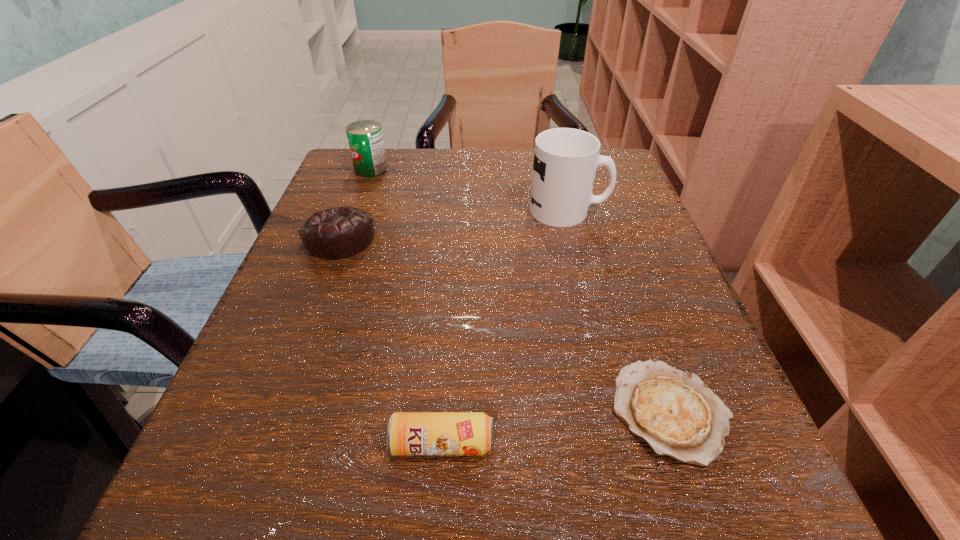
The width and height of the screenshot is (960, 540). I want to click on the tallest object, so click(565, 159).

Find the location of a particular element. The image size is (960, 540). the fourth shortest object is located at coordinates (365, 137).

The width and height of the screenshot is (960, 540). I want to click on the farthest object, so click(365, 137).

Find the location of a particular element. the third shortest object is located at coordinates (342, 232).

This screenshot has height=540, width=960. I want to click on the fourth tallest object, so coord(408,433).

Locate an element on the screen. The image size is (960, 540). beer can is located at coordinates (408, 433).

Identify the location of the shortest object. (674, 412).

Identify the location of vacant space located 0.050m on the right of the can. This screenshot has height=540, width=960. (410, 170).

The image size is (960, 540). I want to click on vacant area located 0.320m on the front of the third shortest object, so click(268, 430).

You are a GUI agent. You are given a task and a screenshot of the screen. Output one action in this format:
    pyautogui.click(x=<x>, y=<y>)
    Task: Click on the vacant space located on the back of the beer can
    The height and width of the screenshot is (540, 960).
    Given the screenshot: What is the action you would take?
    pyautogui.click(x=454, y=266)